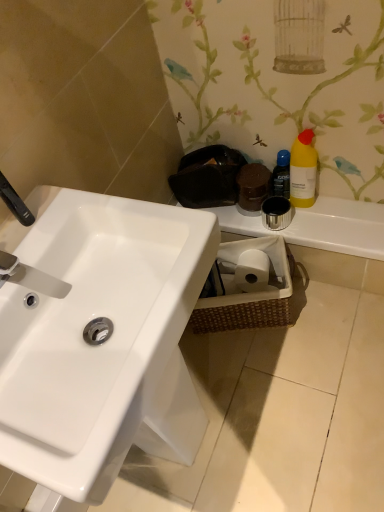
Question: Is matte silver faucet at left, placed as the 2th plumbing fixture when sorted from top to bottom, smaller than woven brown basket at lower right?

Choices:
 (A) yes
 (B) no

Answer: (A)

Question: Can you confirm if matte silver faucet at left, the 1th plumbing fixture when ordered from bottom to top, is shorter than woven brown basket at lower right?

Choices:
 (A) no
 (B) yes

Answer: (B)

Question: Is matte silver faucet at left, the 1th plumbing fixture when ordered from bottom to top, bigger than woven brown basket at lower right?

Choices:
 (A) yes
 (B) no

Answer: (B)

Question: Could you tell me if matte silver faucet at left, the 1th plumbing fixture when ordered from bottom to top, is turned towards woven brown basket at lower right?

Choices:
 (A) no
 (B) yes

Answer: (A)

Question: Considering the relative sizes of matte silver faucet at left, placed as the 2th plumbing fixture when sorted from top to bottom, and woven brown basket at lower right in the image provided, is matte silver faucet at left, placed as the 2th plumbing fixture when sorted from top to bottom, wider than woven brown basket at lower right?

Choices:
 (A) yes
 (B) no

Answer: (B)

Question: From a real-world perspective, relative to brushed metal tap at upper left, the first plumbing fixture in the top-to-bottom sequence, is blue glossy bottle at upper right vertically above or below?

Choices:
 (A) below
 (B) above

Answer: (A)

Question: Is blue glossy bottle at upper right spatially inside brushed metal tap at upper left, which ranks as the 2th plumbing fixture in bottom-to-top order, or outside of it?

Choices:
 (A) outside
 (B) inside

Answer: (A)

Question: Looking at their shapes, would you say blue glossy bottle at upper right is wider or thinner than brushed metal tap at upper left, the first plumbing fixture in the top-to-bottom sequence?

Choices:
 (A) wide
 (B) thin

Answer: (A)

Question: From the image's perspective, is blue glossy bottle at upper right located above or below brushed metal tap at upper left, which ranks as the 2th plumbing fixture in bottom-to-top order?

Choices:
 (A) below
 (B) above

Answer: (B)

Question: From a real-world perspective, is white glossy sink at center physically located above or below brushed metal tap at upper left, the first plumbing fixture in the top-to-bottom sequence?

Choices:
 (A) below
 (B) above

Answer: (A)

Question: Looking at the image, does white glossy sink at center seem bigger or smaller compared to brushed metal tap at upper left, which ranks as the 2th plumbing fixture in bottom-to-top order?

Choices:
 (A) small
 (B) big

Answer: (B)

Question: In terms of width, does white glossy sink at center look wider or thinner when compared to brushed metal tap at upper left, the first plumbing fixture in the top-to-bottom sequence?

Choices:
 (A) wide
 (B) thin

Answer: (A)

Question: From the image's perspective, is white glossy sink at center above or below brushed metal tap at upper left, the first plumbing fixture in the top-to-bottom sequence?

Choices:
 (A) below
 (B) above

Answer: (A)

Question: Is white glossy sink at center inside the boundaries of blue glossy bottle at upper right, or outside?

Choices:
 (A) inside
 (B) outside

Answer: (B)

Question: Is white glossy sink at center wider or thinner than blue glossy bottle at upper right?

Choices:
 (A) wide
 (B) thin

Answer: (A)